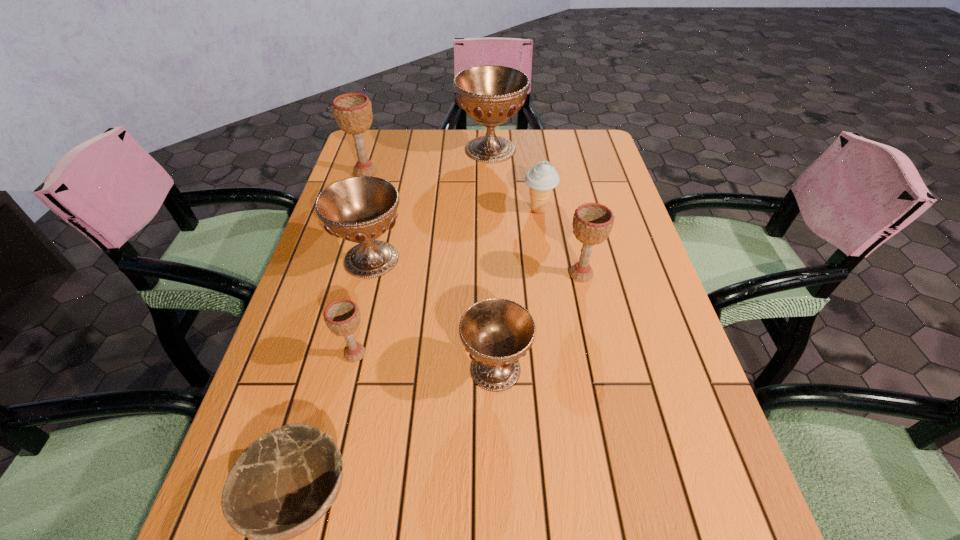
This screenshot has height=540, width=960. In order to click on empty space between the icecream and the second smallest red chalice in this screenshot , I will do `click(455, 234)`.

Where is `free space that is in between the second nearest red chalice and the smallest beige chalice`? Image resolution: width=960 pixels, height=540 pixels. free space that is in between the second nearest red chalice and the smallest beige chalice is located at coordinates (363, 306).

This screenshot has height=540, width=960. What are the coordinates of `object that is the sixth nearest to the second nearest beige chalice` in the screenshot? It's located at [282, 484].

Locate which object is the fourth closest to the rightmost beige chalice. Please provide its 2D coordinates. Your answer should be formatted as a tuple, i.e. [(x, y)], where the tuple contains the x and y coordinates of a point satisfying the conditions above.

[(490, 94)]

Locate an element on the screen. The width and height of the screenshot is (960, 540). the fifth closest chalice to the farthest beige chalice is located at coordinates (497, 332).

Select which chalice appears as the fourth closest to the beige icecream. Please provide its 2D coordinates. Your answer should be formatted as a tuple, i.e. [(x, y)], where the tuple contains the x and y coordinates of a point satisfying the conditions above.

[(497, 332)]

Select which red chalice is the third closest to the icecream. Please provide its 2D coordinates. Your answer should be formatted as a tuple, i.e. [(x, y)], where the tuple contains the x and y coordinates of a point satisfying the conditions above.

[(497, 332)]

Locate an element on the screen. Image resolution: width=960 pixels, height=540 pixels. the second closest red chalice to the bowl is located at coordinates (360, 209).

This screenshot has height=540, width=960. What are the coordinates of `beige chalice that is the second closest to the nearest beige chalice` in the screenshot? It's located at (353, 111).

Find the location of a particular element. Image resolution: width=960 pixels, height=540 pixels. beige chalice identified as the second closest to the rightmost chalice is located at coordinates (353, 111).